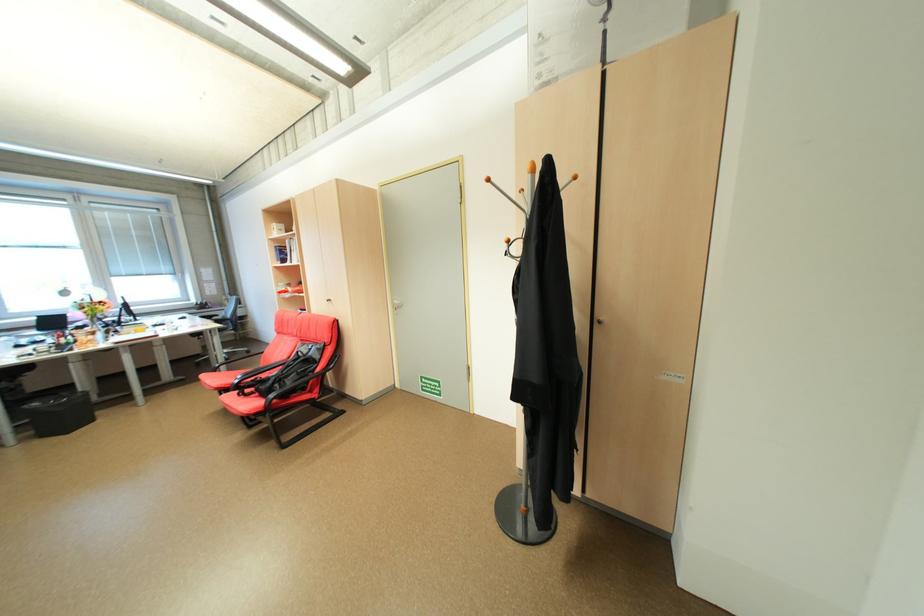
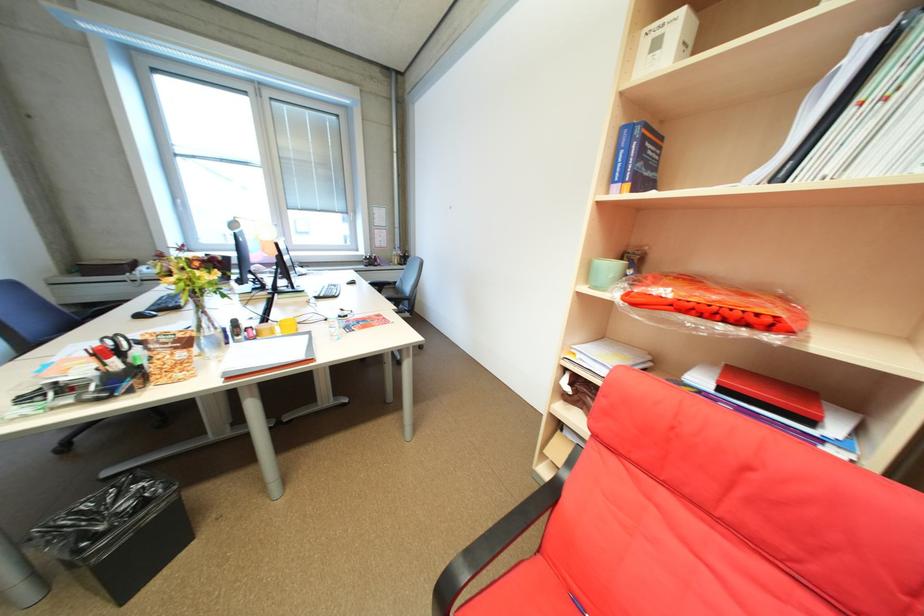
The images are taken continuously from a first-person perspective. In which direction are you moving?

The movement direction of the cameraman is left, forward.